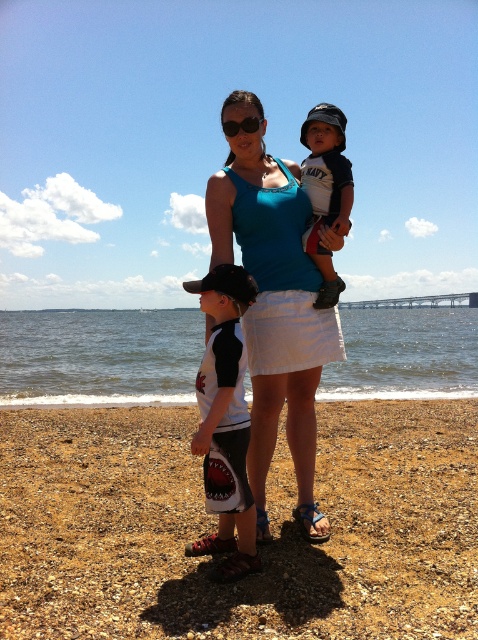
Is brown gravel at lower center to the left of blue fabric tank top at center from the viewer's perspective?

No, brown gravel at lower center is not to the left of blue fabric tank top at center.

Between point (64, 416) and point (229, 228), which one is positioned in front?

Point (229, 228) is more forward.

What do you see at coordinates (215, 525) in the screenshot? This screenshot has height=640, width=478. I see `brown gravel at lower center` at bounding box center [215, 525].

Where is `brown gravel at lower center`? The image size is (478, 640). brown gravel at lower center is located at coordinates (215, 525).

Who is positioned more to the right, brown gravel at lower center or matte navy blue shirt at upper center?

Positioned to the right is matte navy blue shirt at upper center.

Is brown gravel at lower center to the right of matte navy blue shirt at upper center from the viewer's perspective?

In fact, brown gravel at lower center is to the left of matte navy blue shirt at upper center.

Locate an element on the screen. brown gravel at lower center is located at coordinates (215, 525).

Who is positioned more to the right, white matte shirt at center or matte navy blue shirt at upper center?

Positioned to the right is matte navy blue shirt at upper center.

Is white matte shirt at center below matte navy blue shirt at upper center?

Yes, white matte shirt at center is below matte navy blue shirt at upper center.

Who is more forward, [223,291] or [340,234]?

Point [223,291] is more forward.

Image resolution: width=478 pixels, height=640 pixels. In order to click on white matte shirt at center in this screenshot , I will do `click(225, 420)`.